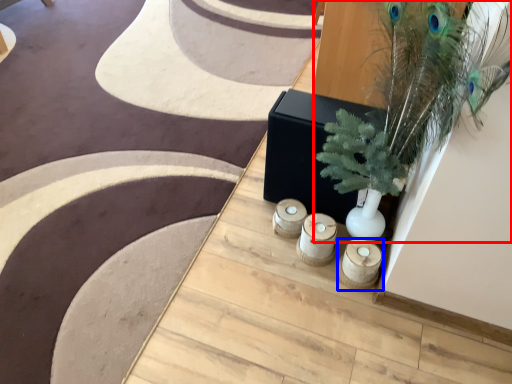
Question: Which of the following is the closest to the observer, houseplant (highlighted by a red box) or candle holder (highlighted by a blue box)?

Choices:
 (A) houseplant
 (B) candle holder

Answer: (A)